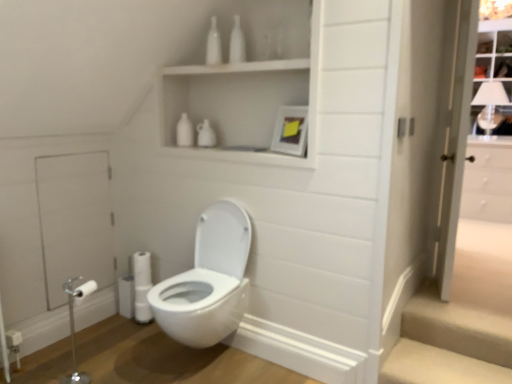
At what (x,y) coordinates should I click in order to perform the action: click on white glossy bottles at upper center, the second toiletry from the left. Please return your answer as a coordinate pair (x, y). Looking at the image, I should click on (237, 43).

Where is `beige carpeted stairs at lower right`? The height and width of the screenshot is (384, 512). beige carpeted stairs at lower right is located at coordinates (449, 343).

Identify the location of white matte toilet paper at lower left. This screenshot has height=384, width=512. (142, 269).

I want to click on clear glass screen door at left, the 1th screen door from the left, so click(75, 220).

What do you see at coordinates (74, 327) in the screenshot?
I see `silver metallic toilet paper holder at lower left` at bounding box center [74, 327].

Where is `silver metallic toilet paper holder at lower left`? This screenshot has height=384, width=512. silver metallic toilet paper holder at lower left is located at coordinates (74, 327).

Find the location of a particular element. This screenshot has height=384, width=512. white glossy bottles at upper center, the second toiletry from the left is located at coordinates [237, 43].

Measure the distance from white glossy cabinet at upper center to white glass window at upper right.

1.56 meters.

Considering the points (254, 73) and (488, 47), which point is in front, point (254, 73) or point (488, 47)?

The point (254, 73) is closer.

Which object is thinner, white glossy cabinet at upper center or white glass window at upper right?

white glossy cabinet at upper center is thinner.

Is white glossy cabinet at upper center positioned far away from white glass window at upper right?

white glossy cabinet at upper center is positioned a significant distance from white glass window at upper right.

From the white glossy toilet at center, count 1st toiletry to the right and point to it. Please provide its 2D coordinates.

[(213, 44)]

Consider the image. From a real-world perspective, between white glossy toilet at center and white glossy bottle at upper center, marked as the second toiletry in a right-to-left arrangement, who is vertically higher?

white glossy bottle at upper center, marked as the second toiletry in a right-to-left arrangement, is physically above.

Is white glossy toilet at center not inside white glossy bottle at upper center, placed as the 1th toiletry when sorted from left to right?

Indeed, white glossy toilet at center is completely outside white glossy bottle at upper center, placed as the 1th toiletry when sorted from left to right.

Considering the sizes of objects white glossy toilet at center and white glossy bottle at upper center, placed as the 1th toiletry when sorted from left to right, in the image provided, who is wider, white glossy toilet at center or white glossy bottle at upper center, placed as the 1th toiletry when sorted from left to right,?

Wider between the two is white glossy toilet at center.

What's the angular difference between white glossy screen door at right, which is the 2th screen door from left to right, and white glossy cabinet at upper center's facing directions?

white glossy screen door at right, which is the 2th screen door from left to right, and white glossy cabinet at upper center are facing 105 degrees away from each other.

From the picture: From the image's perspective, between white glossy screen door at right, which is the 2th screen door from left to right, and white glossy cabinet at upper center, which one is located above?

white glossy cabinet at upper center is shown above in the image.

Can you confirm if white glossy screen door at right, the 1th screen door positioned from the right, is shorter than white glossy cabinet at upper center?

No.

Is white glossy screen door at right, the 1th screen door positioned from the right, surrounding white glossy cabinet at upper center?

No, white glossy cabinet at upper center is not inside white glossy screen door at right, the 1th screen door positioned from the right.

From the image's perspective, is white glass window at upper right over white glossy bottles at upper center, the second toiletry from the left?

Indeed, from the image's perspective, white glass window at upper right is shown above white glossy bottles at upper center, the second toiletry from the left.

Can you tell me how much white glass window at upper right and white glossy bottles at upper center, arranged as the first toiletry when viewed from the right, differ in facing direction?

The angular difference between white glass window at upper right and white glossy bottles at upper center, arranged as the first toiletry when viewed from the right, is 3.16 degrees.

Between white glass window at upper right and white glossy bottles at upper center, the second toiletry from the left, which one has smaller size?

With smaller size is white glossy bottles at upper center, the second toiletry from the left.

Who is taller, white glass window at upper right or white glossy bottles at upper center, the second toiletry from the left?

Standing taller between the two is white glass window at upper right.

In the scene shown: Is white glossy screen door at right, the 1th screen door positioned from the right, not near beige carpeted stairs at lower right?

No.

From the image's perspective, relative to beige carpeted stairs at lower right, is white glossy screen door at right, the 1th screen door positioned from the right, above or below?

From the image's perspective, white glossy screen door at right, the 1th screen door positioned from the right, appears above beige carpeted stairs at lower right.

Between white glossy screen door at right, which is the 2th screen door from left to right, and beige carpeted stairs at lower right, which one appears on the right side from the viewer's perspective?

Positioned to the right is white glossy screen door at right, which is the 2th screen door from left to right.

From a real-world perspective, is white glossy cabinet at upper center located beneath beige carpeted stairs at lower right?

No, from a real-world perspective, white glossy cabinet at upper center is not beneath beige carpeted stairs at lower right.

Does white glossy cabinet at upper center touch beige carpeted stairs at lower right?

No, white glossy cabinet at upper center is not next to beige carpeted stairs at lower right.

Could you tell me if white glossy cabinet at upper center is turned towards beige carpeted stairs at lower right?

No, white glossy cabinet at upper center does not turn towards beige carpeted stairs at lower right.

Is white glossy cabinet at upper center not inside beige carpeted stairs at lower right?

Absolutely, white glossy cabinet at upper center is external to beige carpeted stairs at lower right.

From a real-world perspective, count 1st toiletrys upward from the clear glass screen door at left, the second screen door viewed from the right, and point to it. Please provide its 2D coordinates.

[(213, 44)]

Can you confirm if clear glass screen door at left, the second screen door viewed from the right, is smaller than white glossy bottle at upper center, placed as the 1th toiletry when sorted from left to right?

No.

Which is in front, point (104, 225) or point (208, 61)?

The point (208, 61) is closer.

Identify the location of medicine cabinet located in front of the white glass window at upper right. The image size is (512, 384). (242, 104).

From the white glossy toilet at center, count 2nd toiletrys backward and point to it. Please provide its 2D coordinates.

[(213, 44)]

Estimate the real-world distances between objects in this image. Which object is further from white glossy door at right, white glossy cabinet at upper center or beige carpeted stairs at lower right?

white glossy cabinet at upper center is positioned further to the anchor white glossy door at right.

When comparing their distances from clear glass screen door at left, the 1th screen door from the left, does white glossy cabinet at upper center or beige carpeted stairs at lower right seem closer?

Result: white glossy cabinet at upper center is closer to clear glass screen door at left, the 1th screen door from the left.

Looking at the image, which one is located further to white glossy bottle at upper center, marked as the second toiletry in a right-to-left arrangement, white glossy cabinet at upper center or clear glass screen door at left, the second screen door viewed from the right?

clear glass screen door at left, the second screen door viewed from the right, is positioned further to the anchor white glossy bottle at upper center, marked as the second toiletry in a right-to-left arrangement.

When comparing their distances from white glossy cabinet at upper center, does white glossy screen door at right, which is the 2th screen door from left to right, or silver metallic toilet paper holder at lower left seem closer?

white glossy screen door at right, which is the 2th screen door from left to right, is closer to white glossy cabinet at upper center.

From the image, which object appears to be farther from white glass window at upper right, beige carpeted stairs at lower right or white glossy cabinet at upper center?

Based on the image, beige carpeted stairs at lower right appears to be further to white glass window at upper right.

Consider the image. Looking at the image, which one is located further to clear glass screen door at left, the second screen door viewed from the right, white glossy bottle at upper center, placed as the 1th toiletry when sorted from left to right, or beige carpeted stairs at lower right?

Among the two, beige carpeted stairs at lower right is located further to clear glass screen door at left, the second screen door viewed from the right.

Based on their spatial positions, is silver metallic toilet paper holder at lower left or white glossy cabinet at upper center closer to white glossy bottles at upper center, the second toiletry from the left?

white glossy cabinet at upper center is closer to white glossy bottles at upper center, the second toiletry from the left.

Looking at the image, which one is located closer to white matte toilet paper at lower left, white glossy screen door at right, the 1th screen door positioned from the right, or white glossy toilet at center?

Among the two, white glossy toilet at center is located nearer to white matte toilet paper at lower left.

Find the location of a particular element. medicine cabinet between white glossy bottle at upper center, marked as the second toiletry in a right-to-left arrangement, and clear glass screen door at left, the second screen door viewed from the right, in the up-down direction is located at coordinates (242, 104).

The height and width of the screenshot is (384, 512). I want to click on door between white glossy bottle at upper center, marked as the second toiletry in a right-to-left arrangement, and beige carpeted stairs at lower right, in the vertical direction, so click(423, 150).

What are the coordinates of `toilet paper that lies between white glossy bottles at upper center, arranged as the first toiletry when viewed from the right, and silver metallic toilet paper holder at lower left from top to bottom` in the screenshot? It's located at (142, 269).

Image resolution: width=512 pixels, height=384 pixels. Identify the location of medicine cabinet between silver metallic toilet paper holder at lower left and white glass window at upper right from left to right. (242, 104).